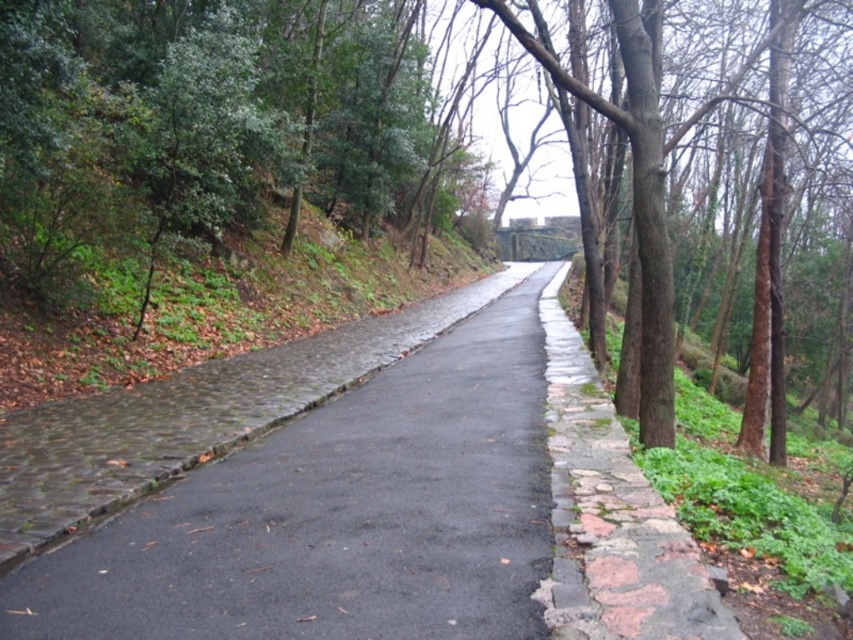
You are standing at the start of the forest path and want to reach a destination located at point (x=480, y=634). There is an obstacle at point (x=91, y=246). Can you safely walk around the obstacle without stepping off the path?

The obstacle at point (x=91, y=246) is closer to you than the destination at point (x=480, y=634). Since the path is narrow and bordered by a stone wall and a slope, you should carefully navigate around the obstacle while staying on the path.

You are a hiker walking along the black asphalt road at center. You want to take a photo of the brown rough tree at center. Which side of the road should you stand on to get the best view of the tree?

The brown rough tree at center is positioned on the right side of the black asphalt road at center. To get the best view, you should stand on the left side of the road so you can clearly see the tree without obstruction from the stone wall on the right.